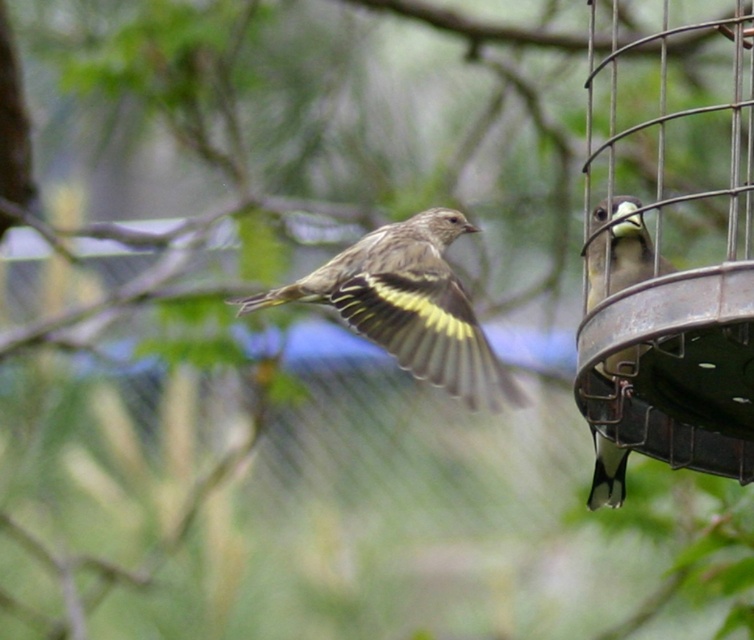
Between brown speckled feathers at center and yellow-green feathers at right, which one has more height?

With more height is yellow-green feathers at right.

Which is more to the right, brown speckled feathers at center or yellow-green feathers at right?

yellow-green feathers at right

Which is behind, point (461, 385) or point (621, 216)?

Positioned behind is point (621, 216).

Locate an element on the screen. The width and height of the screenshot is (754, 640). brown speckled feathers at center is located at coordinates (409, 307).

Does point (746, 472) lie in front of point (299, 284)?

Yes, point (746, 472) is in front of point (299, 284).

From the picture: Does metallic wire bird feeder at right lie behind brown speckled feathers at center?

Yes, metallic wire bird feeder at right is further from the viewer.

Is point (713, 220) more distant than point (489, 360)?

That is True.

At what (x,y) coordinates should I click in order to perform the action: click on metallic wire bird feeder at right. Please return your answer as a coordinate pair (x, y). Looking at the image, I should click on (667, 260).

Based on the photo, how distant is metallic wire bird feeder at right from yellow-green feathers at right?

A distance of 1.45 meters exists between metallic wire bird feeder at right and yellow-green feathers at right.

Based on the photo, can you confirm if metallic wire bird feeder at right is thinner than yellow-green feathers at right?

In fact, metallic wire bird feeder at right might be wider than yellow-green feathers at right.

What are the coordinates of `metallic wire bird feeder at right` in the screenshot? It's located at pyautogui.click(x=667, y=260).